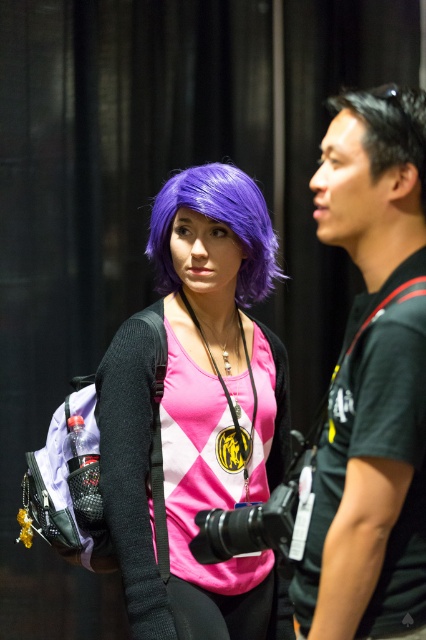
You are organizing a photoshoot and need to ensure that the purple matte wig at center and the black matte shirt at right are visible in the frame. Based on their widths, which object should be placed closer to the camera to maintain visibility?

The purple matte wig at center has a greater width than the black matte shirt at right. To maintain visibility, the black matte shirt at right should be placed closer to the camera since wider objects can be positioned further back and still remain visible.

You are a photographer trying to adjust the focus of your camera on the black matte shirt at right. The camera has a focus point at coordinate point (371, 380). Based on the scene, will this focus point land on the black matte shirt at right?

Yes, the point (371, 380) corresponds to the black matte shirt at right, so the focus point will land on it.